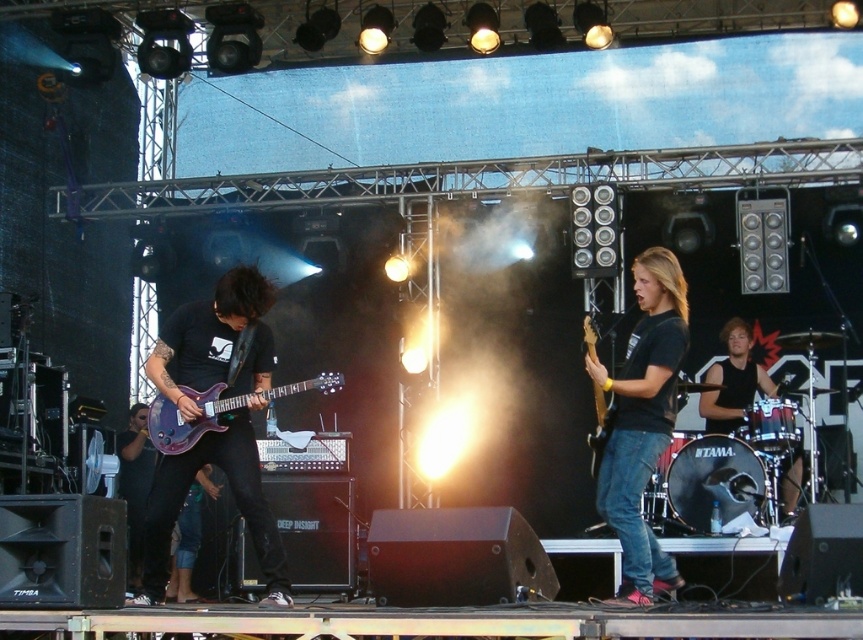
Question: Which point is farther to the camera?

Choices:
 (A) (649, 336)
 (B) (156, 548)
 (C) (717, 410)
 (D) (594, 458)

Answer: (C)

Question: Is matte black guitar at left thinner than brown wood guitar at center-right?

Choices:
 (A) yes
 (B) no

Answer: (B)

Question: Which object is farther from the camera taking this photo?

Choices:
 (A) black matte shirt at center
 (B) black sleeveless shirt at center

Answer: (B)

Question: Is matte black guitar at left thinner than black sleeveless shirt at center?

Choices:
 (A) yes
 (B) no

Answer: (B)

Question: Does matte black guitar at left appear under black sleeveless shirt at center?

Choices:
 (A) no
 (B) yes

Answer: (B)

Question: Among these points, which one is farthest from the camera?

Choices:
 (A) (597, 413)
 (B) (240, 483)
 (C) (177, 387)
 (D) (735, 394)

Answer: (D)